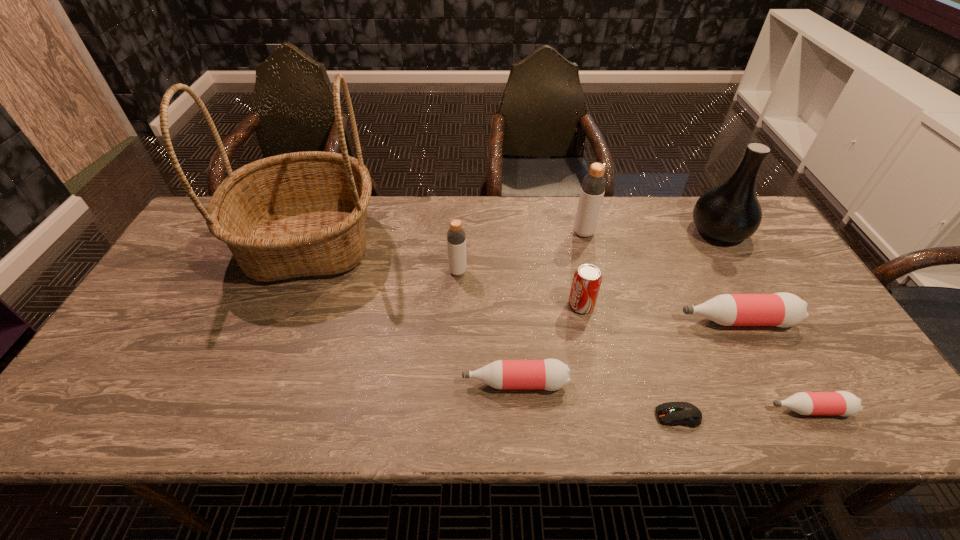
The width and height of the screenshot is (960, 540). What are the coordinates of `vacant area located on the button of the shortest object` in the screenshot? It's located at (587, 416).

Where is `vacant region located on the button of the shortest object`? This screenshot has height=540, width=960. vacant region located on the button of the shortest object is located at coordinates (531, 416).

This screenshot has width=960, height=540. I want to click on blank space located on the button of the shortest object, so click(x=513, y=416).

I want to click on basket that is at the far edge, so (298, 214).

The image size is (960, 540). What are the coordinates of `vase at the far edge` in the screenshot? It's located at (731, 212).

Locate an element on the screen. bottle at the far edge is located at coordinates tap(593, 187).

The height and width of the screenshot is (540, 960). In order to click on computer equipment that is at the near edge in this screenshot , I will do `click(674, 413)`.

Where is `object located in the left edge section of the desktop`? The height and width of the screenshot is (540, 960). object located in the left edge section of the desktop is located at coordinates (298, 214).

The height and width of the screenshot is (540, 960). Find the location of `vase present at the right edge`. vase present at the right edge is located at coordinates (731, 212).

Where is `object that is at the far left corner`? The height and width of the screenshot is (540, 960). object that is at the far left corner is located at coordinates (298, 214).